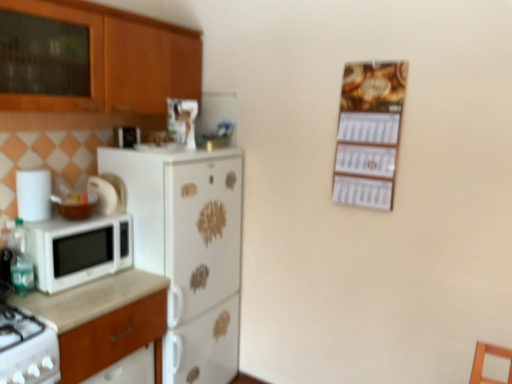
You are a GUI agent. You are given a task and a screenshot of the screen. Output one action in this format:
    pyautogui.click(x=<x>, y=<y>)
    Task: Click on the vacant area located to the right-hand side of translucent plastic bottle at left
    This screenshot has width=512, height=384.
    Given the screenshot: What is the action you would take?
    pyautogui.click(x=63, y=297)